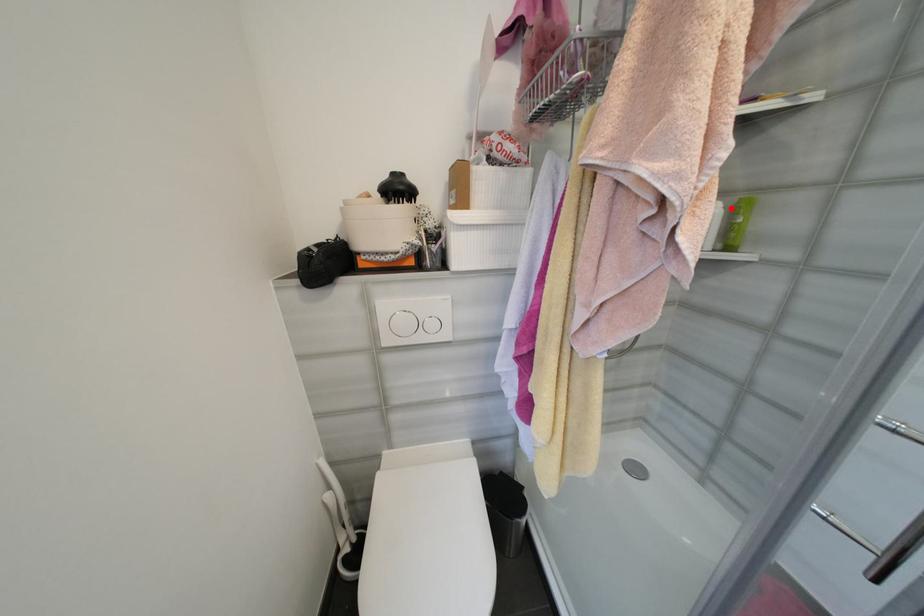
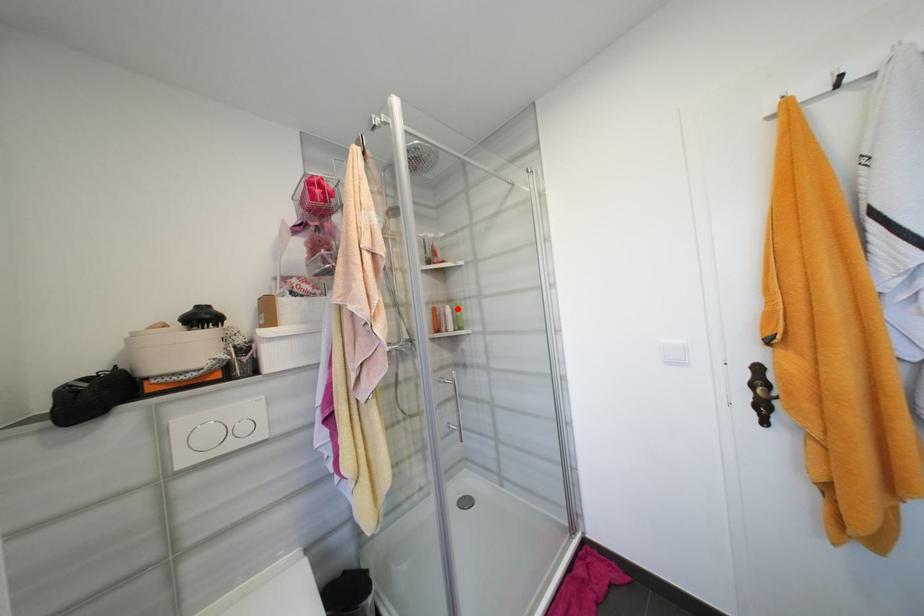
I am providing you with two images of the same scene from different viewpoints. A red point is marked on the first image and another point is marked on the second image. Is the marked point in image1 the same physical position as the marked point in image2?

Yes